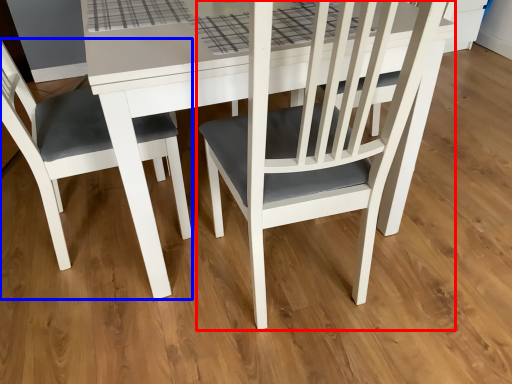
Question: Which point is further to the camera, chair (highlighted by a red box) or chair (highlighted by a blue box)?

Choices:
 (A) chair
 (B) chair

Answer: (A)